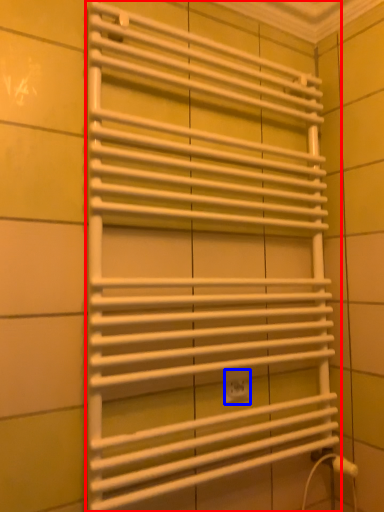
Question: Which point is further to the camera, towel rack (highlighted by a red box) or electric outlet (highlighted by a blue box)?

Choices:
 (A) towel rack
 (B) electric outlet

Answer: (B)